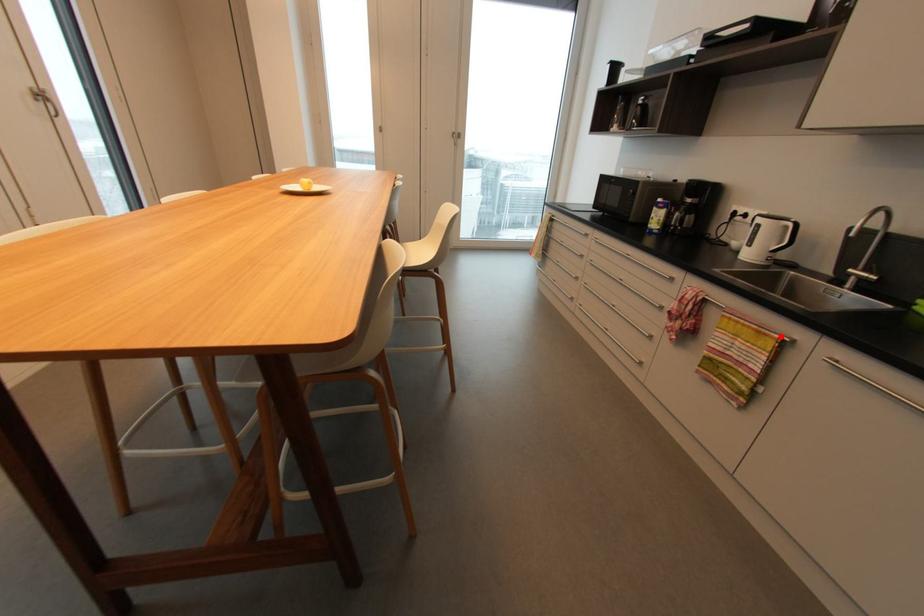
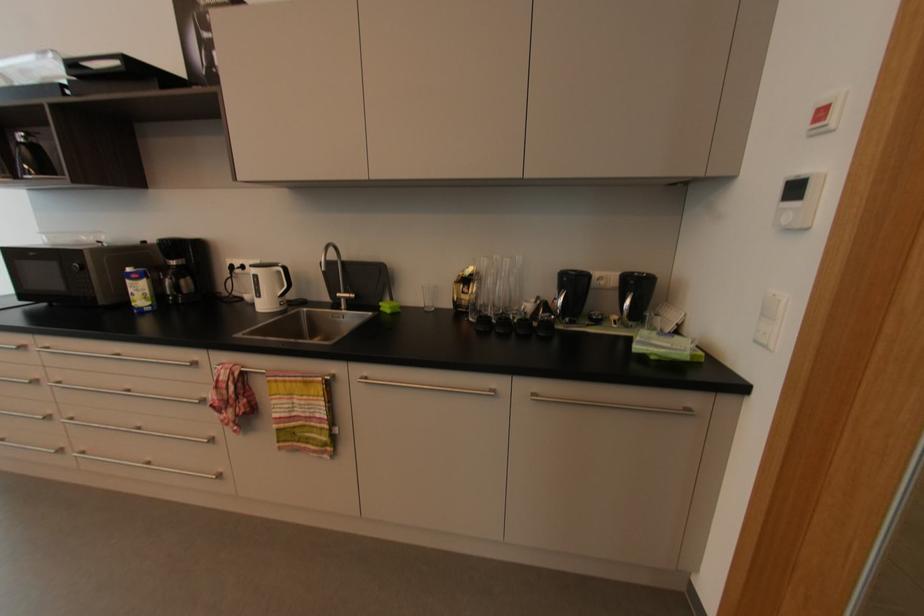
In the second image, find the point that corresponds to the highlighted location in the first image.

(323, 379)